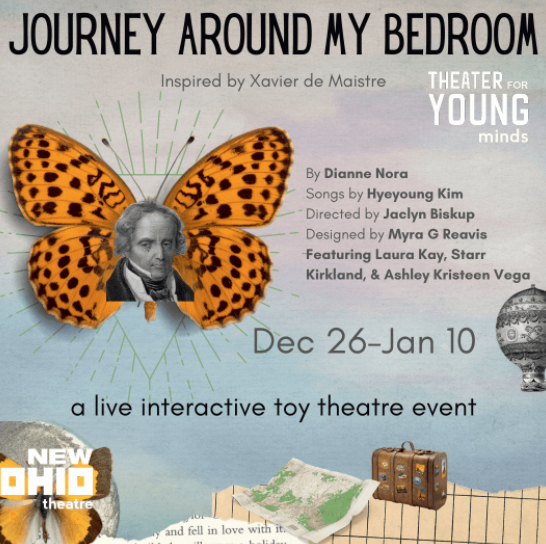
Find the location of `urn`. urn is located at coordinates (536, 338).